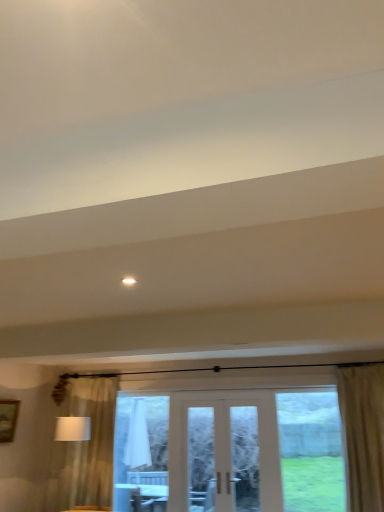
Question: Considering the relative sizes of clear glass door at center and beige textured curtain at right in the image provided, is clear glass door at center shorter than beige textured curtain at right?

Choices:
 (A) no
 (B) yes

Answer: (B)

Question: Is clear glass door at center outside beige textured curtain at right?

Choices:
 (A) no
 (B) yes

Answer: (B)

Question: Can you confirm if clear glass door at center is wider than beige textured curtain at right?

Choices:
 (A) yes
 (B) no

Answer: (B)

Question: Is clear glass door at center with beige textured curtain at right?

Choices:
 (A) yes
 (B) no

Answer: (B)

Question: Is clear glass door at center facing away from beige textured curtain at right?

Choices:
 (A) yes
 (B) no

Answer: (B)

Question: Is white fabric lampshade at left spatially inside white fabric at center, or outside of it?

Choices:
 (A) inside
 (B) outside

Answer: (B)

Question: Based on their positions, is white fabric lampshade at left located to the left or right of white fabric at center?

Choices:
 (A) right
 (B) left

Answer: (B)

Question: Relative to white fabric at center, is white fabric lampshade at left in front or behind?

Choices:
 (A) front
 (B) behind

Answer: (A)

Question: Is point (67, 419) positioned closer to the camera than point (163, 468)?

Choices:
 (A) farther
 (B) closer

Answer: (B)

Question: Which is correct: white fabric lampshade at left is inside clear glass window at center, or outside of it?

Choices:
 (A) inside
 (B) outside

Answer: (B)

Question: Is white fabric lampshade at left taller or shorter than clear glass window at center?

Choices:
 (A) tall
 (B) short

Answer: (B)

Question: Looking at their shapes, would you say white fabric lampshade at left is wider or thinner than clear glass window at center?

Choices:
 (A) wide
 (B) thin

Answer: (A)

Question: Is white fabric lampshade at left in front of or behind clear glass window at center in the image?

Choices:
 (A) behind
 (B) front

Answer: (B)

Question: In the image, is white glossy light at upper center on the left side or the right side of white fabric at center?

Choices:
 (A) left
 (B) right

Answer: (B)

Question: Is white glossy light at upper center wider or thinner than white fabric at center?

Choices:
 (A) wide
 (B) thin

Answer: (A)